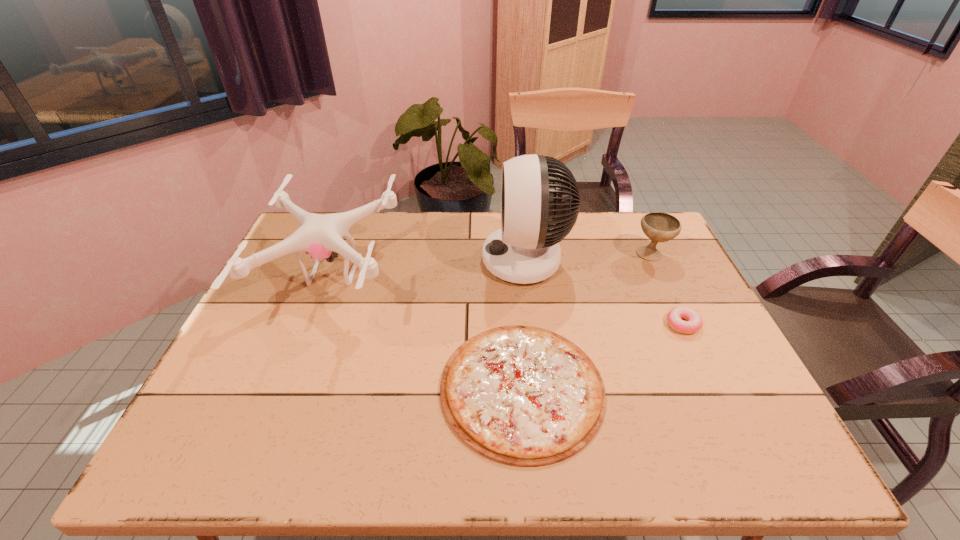
I want to click on vacant space that satisfies the following two spatial constraints: 1. on the back side of the shortest object; 2. on the left side of the chalice, so click(x=511, y=254).

You are a GUI agent. You are given a task and a screenshot of the screen. Output one action in this format:
    pyautogui.click(x=<x>, y=<y>)
    Task: Click on the free location that satisfies the following two spatial constraints: 1. on the back side of the shortest object; 2. on the left side of the fourth tallest object
    This screenshot has height=540, width=960.
    Given the screenshot: What is the action you would take?
    pyautogui.click(x=516, y=324)

Where is `vacant point that satisfies the following two spatial constraints: 1. on the top of the drone; 2. on the left side of the second shortest object`? vacant point that satisfies the following two spatial constraints: 1. on the top of the drone; 2. on the left side of the second shortest object is located at coordinates (314, 324).

Locate an element on the screen. This screenshot has width=960, height=540. vacant space that satisfies the following two spatial constraints: 1. on the grille of the fan; 2. on the right side of the doughnut is located at coordinates (533, 324).

The image size is (960, 540). In order to click on vacant position in the image that satisfies the following two spatial constraints: 1. on the grille of the doughnut; 2. on the left side of the fan in this screenshot , I will do `click(533, 324)`.

Identify the location of vacant area in the image that satisfies the following two spatial constraints: 1. on the top of the drone; 2. on the left side of the shortest object. The image size is (960, 540). (289, 388).

Locate an element on the screen. free space that satisfies the following two spatial constraints: 1. on the grille of the fan; 2. on the right side of the fourth tallest object is located at coordinates (533, 324).

This screenshot has height=540, width=960. Find the location of `free space that satisfies the following two spatial constraints: 1. on the back side of the third tallest object; 2. on the right side of the shortest object`. free space that satisfies the following two spatial constraints: 1. on the back side of the third tallest object; 2. on the right side of the shortest object is located at coordinates (511, 254).